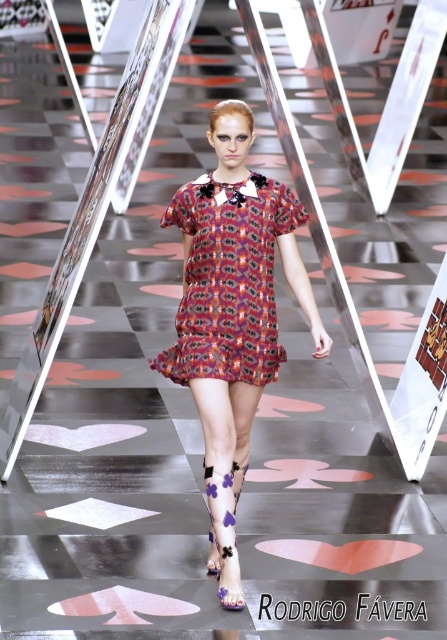
You are standing in the runway scene and want to know how far you are from the point marked as point (249, 332). Can you determine the distance?

The distance between you and point (249, 332) is 13.15 feet.

You are a fashion designer observing the runway show. You notice two dresses at the center of the image. Which dress has a wider silhouette? The options are the printed fabric dress at center and the printed silk dress at center.

The printed fabric dress at center has a wider silhouette than the printed silk dress at center according to the description.